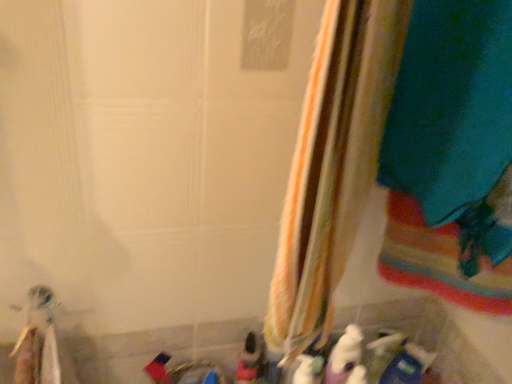
Question: Can you confirm if blue plastic toy at lower right, which is the fifth toy from left to right, is taller than white plastic toothbrush at lower left, which ranks as the fifth toy in right-to-left order?

Choices:
 (A) yes
 (B) no

Answer: (B)

Question: Is blue plastic toy at lower right, which is the fifth toy from left to right, next to white plastic toothbrush at lower left, the first toy from the left?

Choices:
 (A) yes
 (B) no

Answer: (B)

Question: Is blue plastic toy at lower right, the first toy in the right-to-left sequence, far from white plastic toothbrush at lower left, which ranks as the fifth toy in right-to-left order?

Choices:
 (A) yes
 (B) no

Answer: (B)

Question: From the image's perspective, would you say blue plastic toy at lower right, the first toy in the right-to-left sequence, is positioned over white plastic toothbrush at lower left, which ranks as the fifth toy in right-to-left order?

Choices:
 (A) no
 (B) yes

Answer: (A)

Question: Considering the relative sizes of blue plastic toy at lower right, which is the fifth toy from left to right, and white plastic toothbrush at lower left, the first toy from the left, in the image provided, is blue plastic toy at lower right, which is the fifth toy from left to right, shorter than white plastic toothbrush at lower left, the first toy from the left,?

Choices:
 (A) no
 (B) yes

Answer: (B)

Question: Is white plastic toothbrush at lower left, the first toy from the left, inside the boundaries of blue plastic toy at lower right, which is the fifth toy from left to right, or outside?

Choices:
 (A) outside
 (B) inside

Answer: (A)

Question: In terms of width, does white plastic toothbrush at lower left, which ranks as the fifth toy in right-to-left order, look wider or thinner when compared to blue plastic toy at lower right, which is the fifth toy from left to right?

Choices:
 (A) thin
 (B) wide

Answer: (B)

Question: Considering their positions, is white plastic toothbrush at lower left, which ranks as the fifth toy in right-to-left order, located in front of or behind blue plastic toy at lower right, which is the fifth toy from left to right?

Choices:
 (A) front
 (B) behind

Answer: (A)

Question: In terms of height, does white plastic toothbrush at lower left, which ranks as the fifth toy in right-to-left order, look taller or shorter compared to blue plastic toy at lower right, which is the fifth toy from left to right?

Choices:
 (A) tall
 (B) short

Answer: (A)

Question: Based on their positions, is striped fabric curtain at center located to the left or right of white matte bottle at lower center, which is the 2th toy in right-to-left order?

Choices:
 (A) left
 (B) right

Answer: (A)

Question: Do you think striped fabric curtain at center is within white matte bottle at lower center, which is the 2th toy in right-to-left order, or outside of it?

Choices:
 (A) outside
 (B) inside

Answer: (A)

Question: Relative to white matte bottle at lower center, which is the fourth toy in left-to-right order, is striped fabric curtain at center in front or behind?

Choices:
 (A) front
 (B) behind

Answer: (A)

Question: Is point (314, 74) closer or farther from the camera than point (372, 375)?

Choices:
 (A) farther
 (B) closer

Answer: (B)

Question: Does point (318, 278) appear closer or farther from the camera than point (409, 365)?

Choices:
 (A) closer
 (B) farther

Answer: (A)

Question: From their relative heights in the image, would you say striped fabric curtain at center is taller or shorter than blue plastic toy at lower right, which is the fifth toy from left to right?

Choices:
 (A) tall
 (B) short

Answer: (A)